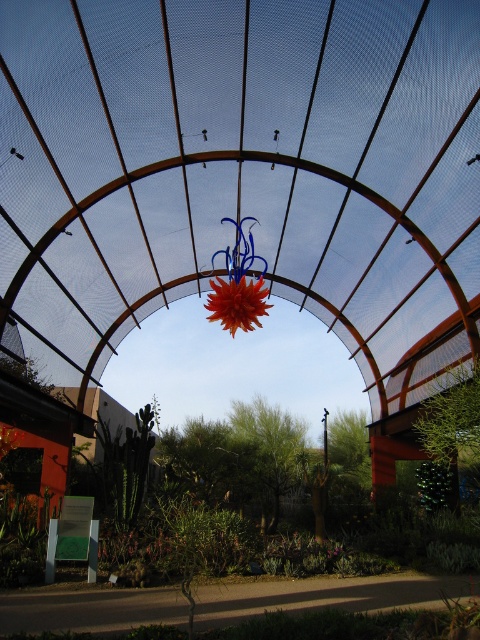
Between transparent mesh canopy at center and shiny orange flower at center, which one appears on the right side from the viewer's perspective?

Positioned to the right is shiny orange flower at center.

Who is lower down, transparent mesh canopy at center or shiny orange flower at center?

Positioned lower is shiny orange flower at center.

Does point (72, 116) come behind point (211, 285)?

No, (72, 116) is in front of (211, 285).

Where is `transparent mesh canopy at center`? This screenshot has height=640, width=480. transparent mesh canopy at center is located at coordinates (242, 173).